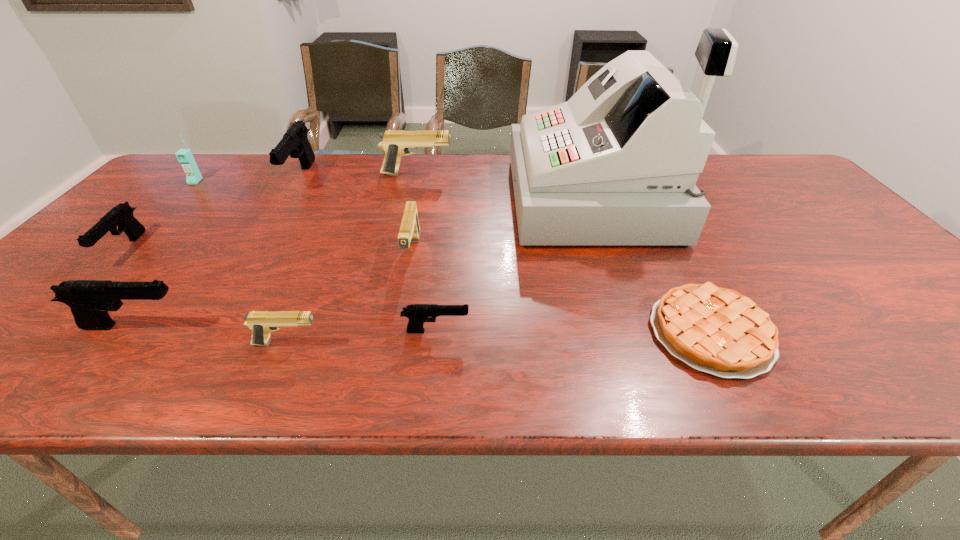
Where is `free point between the pie and the biggest tan pistol`? The height and width of the screenshot is (540, 960). free point between the pie and the biggest tan pistol is located at coordinates (564, 253).

In order to click on vacant point located between the nearest pistol and the cellular telephone in this screenshot , I will do `click(241, 262)`.

Locate an element on the screen. The width and height of the screenshot is (960, 540). free spot between the fifth object from left to right and the shortest object is located at coordinates (499, 338).

I want to click on vacant area that lies between the second black pistol from right to left and the pie, so click(506, 255).

At what (x,y) coordinates should I click in order to perform the action: click on vacant space that's between the leftmost tan pistol and the third pistol from left to right. Please return your answer as a coordinate pair (x, y). Looking at the image, I should click on 294,260.

Locate an element on the screen. This screenshot has width=960, height=540. unoccupied area between the second farthest tan pistol and the biggest black pistol is located at coordinates 356,215.

Identify which object is the sixth nearest to the leftmost black pistol. Please provide its 2D coordinates. Your answer should be formatted as a tuple, i.e. [(x, y)], where the tuple contains the x and y coordinates of a point satisfying the conditions above.

[(409, 231)]

Select which object appears as the seventh closest to the cellular telephone. Please provide its 2D coordinates. Your answer should be formatted as a tuple, i.e. [(x, y)], where the tuple contains the x and y coordinates of a point satisfying the conditions above.

[(418, 314)]

This screenshot has height=540, width=960. Find the location of `pistol object that ranks as the fourth closest to the second farthest black pistol`. pistol object that ranks as the fourth closest to the second farthest black pistol is located at coordinates (395, 143).

Choose which pistol is the fourth nearest neighbor to the second farthest tan pistol. Please provide its 2D coordinates. Your answer should be formatted as a tuple, i.e. [(x, y)], where the tuple contains the x and y coordinates of a point satisfying the conditions above.

[(295, 143)]